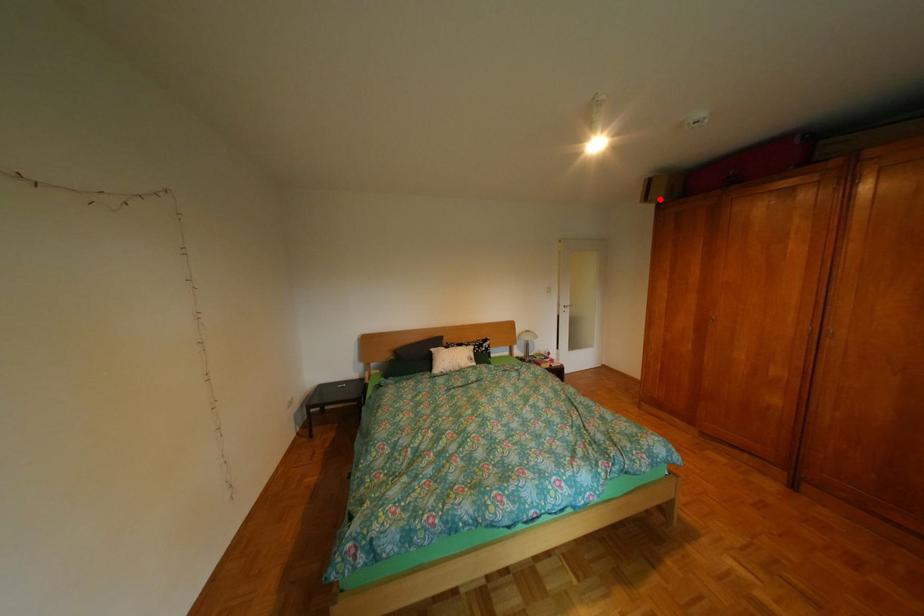
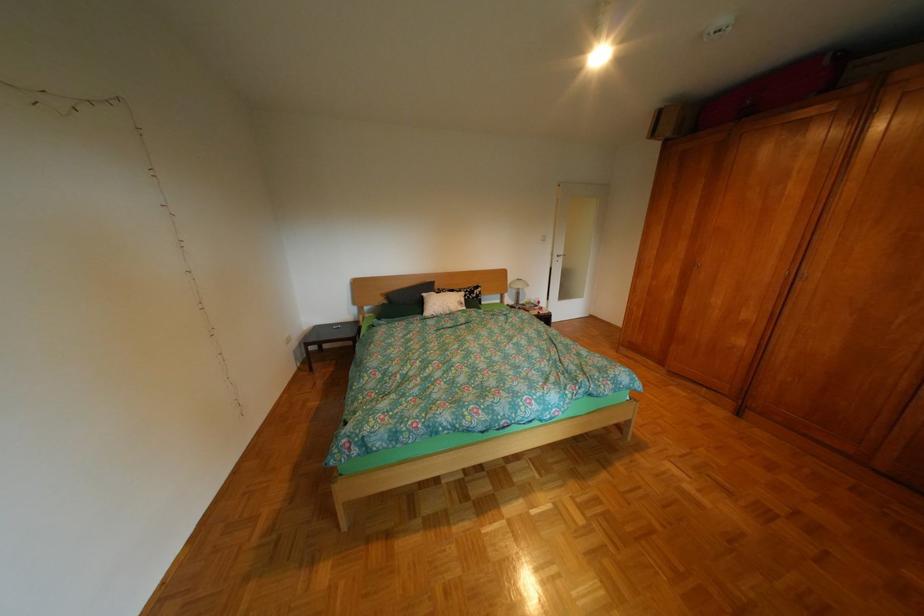
Locate, in the second image, the point that corresponds to the highlighted location in the first image.

(667, 136)